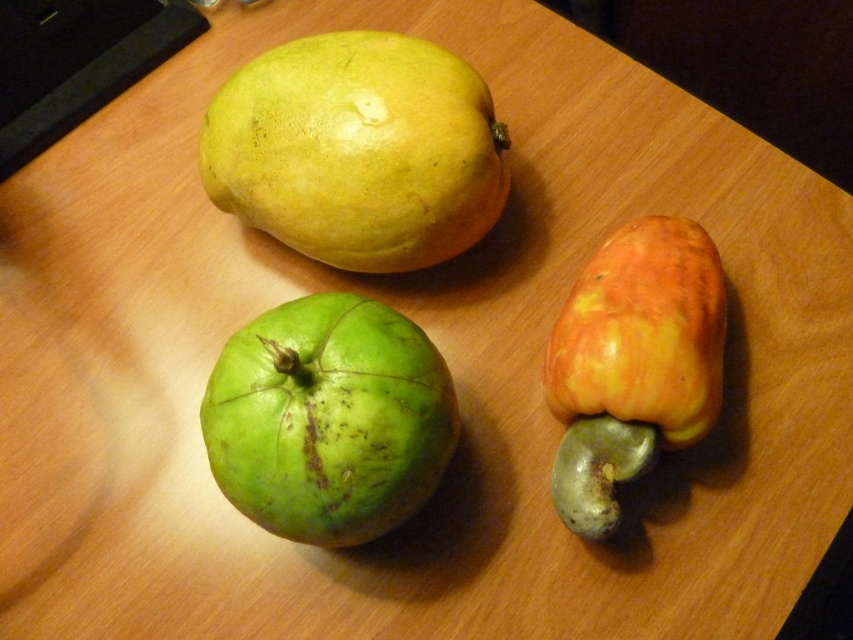
Who is more forward, (335,516) or (581,492)?

Point (335,516) is more forward.

Is point (228, 442) closer to camera compared to point (614, 513)?

Yes.

Does point (405, 442) lie behind point (703, 314)?

No.

Image resolution: width=853 pixels, height=640 pixels. What are the coordinates of `green matte apple at center` in the screenshot? It's located at (328, 419).

Does point (293, 49) lie in front of point (360, 465)?

No, it is not.

Is point (418, 72) positioned after point (408, 378)?

Yes, it is behind point (408, 378).

Where is `yellow matte mango at upper left`? The width and height of the screenshot is (853, 640). yellow matte mango at upper left is located at coordinates (357, 150).

Does yellow matte mango at upper left have a lesser width compared to yellow-orange matte cashew at right?

In fact, yellow matte mango at upper left might be wider than yellow-orange matte cashew at right.

In the scene shown: Is yellow matte mango at upper left bigger than yellow-orange matte cashew at right?

Indeed, yellow matte mango at upper left has a larger size compared to yellow-orange matte cashew at right.

Where is `yellow matte mango at upper left`? yellow matte mango at upper left is located at coordinates pyautogui.click(x=357, y=150).